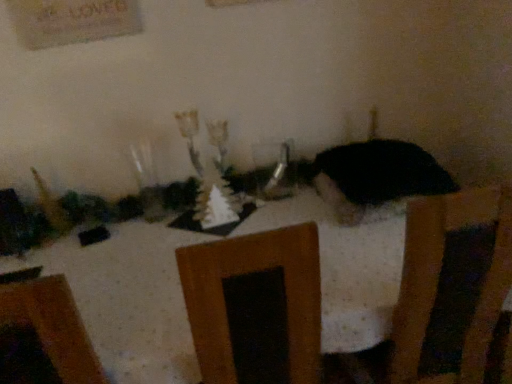
Measure the distance between white dotted tablecloth at center and camera.

white dotted tablecloth at center and camera are 31.97 inches apart.

Measure the distance between clear glass vase at center and camera.

The depth of clear glass vase at center is 5.83 feet.

The height and width of the screenshot is (384, 512). I want to click on white dotted tablecloth at center, so click(x=144, y=299).

Between clear glass vase at center and black matte cat at center, which one has more height?

Standing taller between the two is clear glass vase at center.

From the image's perspective, between clear glass vase at center and black matte cat at center, who is located below?

black matte cat at center.

This screenshot has height=384, width=512. In order to click on tableware above the black matte cat at center (from a real-world perspective) in this screenshot , I will do `click(272, 171)`.

How many degrees apart are the facing directions of white dotted tablecloth at center and clear glass vase at center?

6.44 degrees.

From the image's perspective, between white dotted tablecloth at center and clear glass vase at center, who is located below?

white dotted tablecloth at center appears lower in the image.

Where is `furniture that appears in front of the clear glass vase at center`? furniture that appears in front of the clear glass vase at center is located at coordinates 144,299.

Between white dotted tablecloth at center and clear glass vase at center, which one has smaller size?

clear glass vase at center is smaller.

From a real-world perspective, which is physically below, black matte cat at center or white dotted tablecloth at center?

white dotted tablecloth at center.

Find the location of `animal above the white dotted tablecloth at center (from a real-world perspective)`. animal above the white dotted tablecloth at center (from a real-world perspective) is located at coordinates (376, 176).

Can you confirm if black matte cat at center is taller than white dotted tablecloth at center?

No, black matte cat at center is not taller than white dotted tablecloth at center.

Considering the relative sizes of black matte cat at center and white dotted tablecloth at center in the image provided, is black matte cat at center bigger than white dotted tablecloth at center?

No.

Which is nearer, (355, 189) or (274, 175)?

Clearly, point (355, 189) is closer to the camera than point (274, 175).

How different are the orientations of black matte cat at center and clear glass vase at center in degrees?

4.63 degrees.

Would you say black matte cat at center is outside clear glass vase at center?

black matte cat at center is positioned outside clear glass vase at center.

Where is `tableware located above the black matte cat at center (from the image's perspective)`? The height and width of the screenshot is (384, 512). tableware located above the black matte cat at center (from the image's perspective) is located at coordinates (272, 171).

Relative to white dotted tablecloth at center, is clear glass vase at center in front or behind?

Clearly, clear glass vase at center is behind white dotted tablecloth at center.

From the picture: Which of these two, clear glass vase at center or white dotted tablecloth at center, stands taller?

Standing taller between the two is white dotted tablecloth at center.

Are clear glass vase at center and white dotted tablecloth at center making contact?

clear glass vase at center is not next to white dotted tablecloth at center, and they're not touching.

Looking at this image, between clear glass vase at center and white dotted tablecloth at center, which one appears on the right side from the viewer's perspective?

clear glass vase at center.

You are a GUI agent. You are given a task and a screenshot of the screen. Output one action in this format:
    pyautogui.click(x=<x>, y=<y>)
    Task: Click on the animal lying above the white dotted tablecloth at center (from the image's perspective)
    The width and height of the screenshot is (512, 384).
    Given the screenshot: What is the action you would take?
    pyautogui.click(x=376, y=176)

Is black matte cat at center at the back of white dotted tablecloth at center?

That's not correct — white dotted tablecloth at center is not looking away from black matte cat at center.

Can you tell me how much white dotted tablecloth at center and black matte cat at center differ in facing direction?

They differ by 1.81 degrees in their facing directions.

Measure the distance from white dotted tablecloth at center to black matte cat at center.

A distance of 14.51 inches exists between white dotted tablecloth at center and black matte cat at center.

Image resolution: width=512 pixels, height=384 pixels. I want to click on animal on the right of clear glass vase at center, so [376, 176].

Find the location of a particular element. The width and height of the screenshot is (512, 384). furniture below the clear glass vase at center (from a real-world perspective) is located at coordinates (144, 299).

Estimate the real-world distances between objects in this image. Which object is further from white dotted tablecloth at center, black matte cat at center or clear glass vase at center?

clear glass vase at center.

Looking at the image, which one is located closer to clear glass vase at center, black matte cat at center or white dotted tablecloth at center?

black matte cat at center lies closer to clear glass vase at center than the other object.

Estimate the real-world distances between objects in this image. Which object is closer to white dotted tablecloth at center, clear glass vase at center or black matte cat at center?

black matte cat at center is positioned closer to the anchor white dotted tablecloth at center.

Considering their positions, is clear glass vase at center positioned closer to black matte cat at center than white dotted tablecloth at center?

Based on the image, clear glass vase at center appears to be nearer to black matte cat at center.

From the image, which object appears to be nearer to black matte cat at center, white dotted tablecloth at center or clear glass vase at center?

Among the two, clear glass vase at center is located nearer to black matte cat at center.

In the scene shown: Based on their spatial positions, is white dotted tablecloth at center or black matte cat at center further from clear glass vase at center?

white dotted tablecloth at center lies further to clear glass vase at center than the other object.

Find the location of a particular element. Image resolution: width=512 pixels, height=384 pixels. animal between white dotted tablecloth at center and clear glass vase at center from front to back is located at coordinates 376,176.